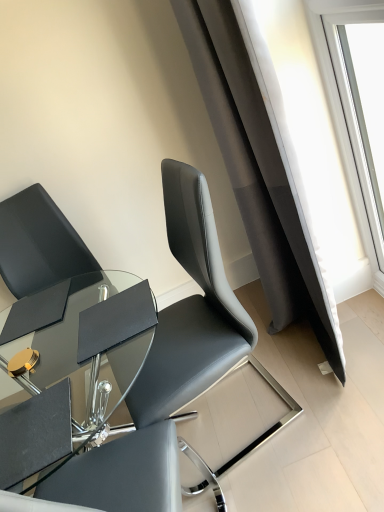
Question: Would you say black leather chair at left, the first chair when ordered from left to right, is outside transparent glass window at upper right?

Choices:
 (A) yes
 (B) no

Answer: (A)

Question: Is black leather chair at left, positioned as the 2th chair in right-to-left order, far from transparent glass window at upper right?

Choices:
 (A) yes
 (B) no

Answer: (A)

Question: Does black leather chair at left, positioned as the 2th chair in right-to-left order, appear on the left side of transparent glass window at upper right?

Choices:
 (A) no
 (B) yes

Answer: (B)

Question: Is black leather chair at left, positioned as the 2th chair in right-to-left order, behind transparent glass window at upper right?

Choices:
 (A) yes
 (B) no

Answer: (A)

Question: Is black leather chair at left, positioned as the 2th chair in right-to-left order, beside transparent glass window at upper right?

Choices:
 (A) no
 (B) yes

Answer: (A)

Question: From the image's perspective, is black leather chair at left, positioned as the 2th chair in right-to-left order, under transparent glass window at upper right?

Choices:
 (A) no
 (B) yes

Answer: (B)

Question: Can you confirm if transparent glass window at upper right is taller than black leather chair at left, positioned as the 2th chair in right-to-left order?

Choices:
 (A) yes
 (B) no

Answer: (A)

Question: Does transparent glass window at upper right contain black leather chair at left, the first chair when ordered from left to right?

Choices:
 (A) yes
 (B) no

Answer: (B)

Question: Does transparent glass window at upper right have a greater width compared to black leather chair at left, the first chair when ordered from left to right?

Choices:
 (A) no
 (B) yes

Answer: (A)

Question: From a real-world perspective, is transparent glass window at upper right on top of black leather chair at left, positioned as the 2th chair in right-to-left order?

Choices:
 (A) no
 (B) yes

Answer: (B)

Question: Is transparent glass window at upper right smaller than black leather chair at left, the first chair when ordered from left to right?

Choices:
 (A) no
 (B) yes

Answer: (B)

Question: Is transparent glass window at upper right turned away from black leather chair at left, positioned as the 2th chair in right-to-left order?

Choices:
 (A) no
 (B) yes

Answer: (A)

Question: From the image's perspective, would you say matte black chair at upper left, the second chair from the left, is positioned over black leather chair at left, the first chair when ordered from left to right?

Choices:
 (A) no
 (B) yes

Answer: (B)